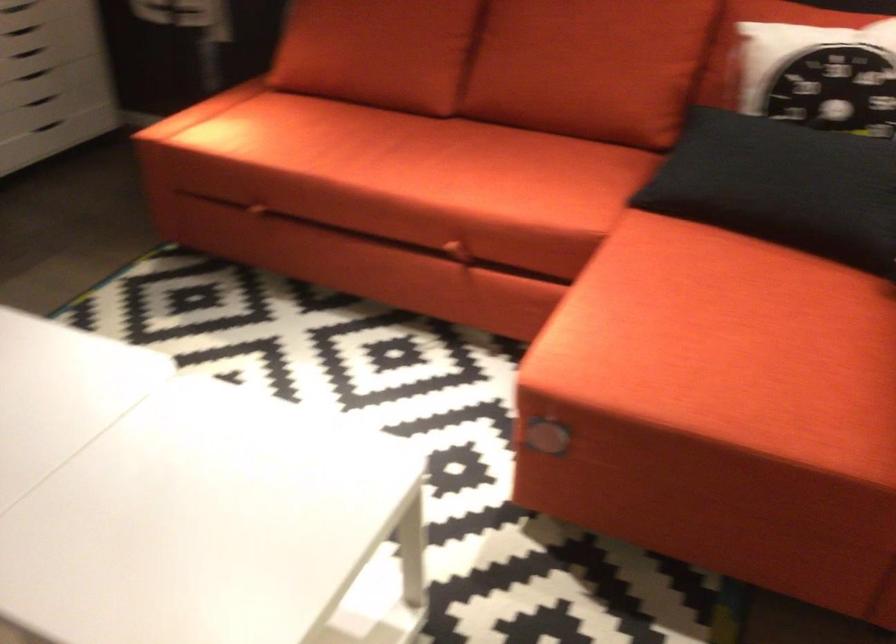
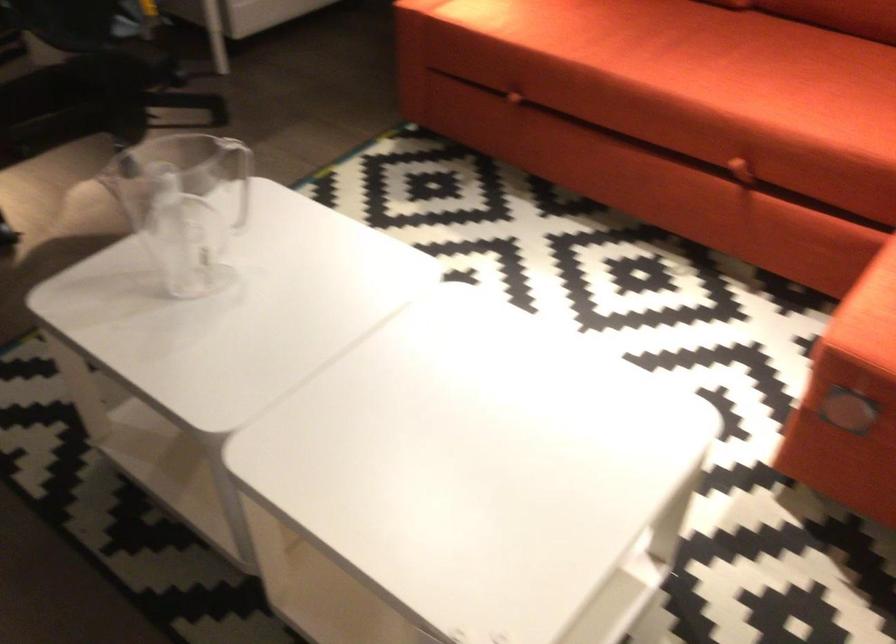
Locate, in the second image, the point that corresponds to point 454,245 in the first image.

(737, 160)